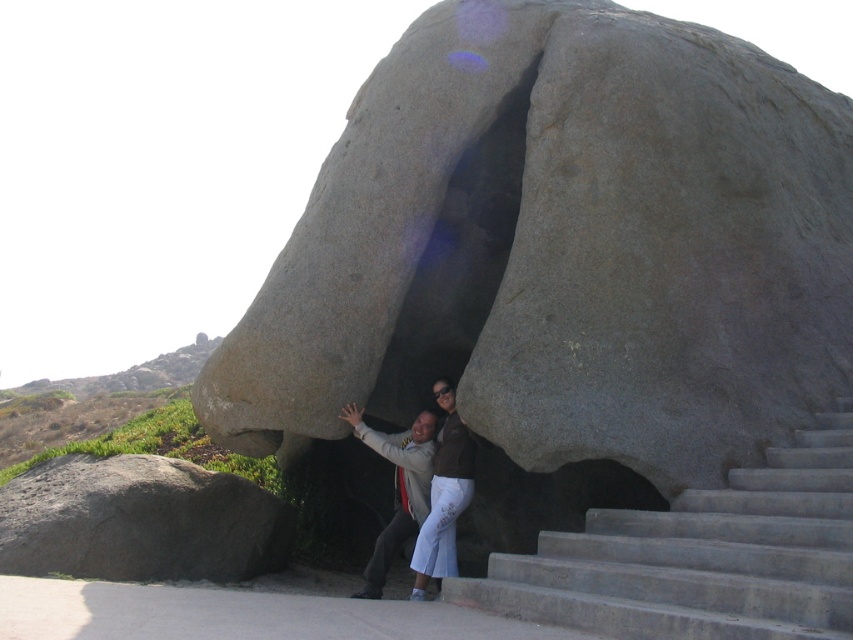
Which is more to the left, gray rough boulder at lower left or matte gray stone couple at center?

Positioned to the left is gray rough boulder at lower left.

Does gray rough boulder at lower left appear on the left side of matte gray stone couple at center?

Yes, gray rough boulder at lower left is to the left of matte gray stone couple at center.

Who is more distant from viewer, (49,528) or (467,502)?

Positioned behind is point (467,502).

I want to click on gray rough boulder at lower left, so click(140, 522).

Is concrete stairs at lower right bigger than gray rough boulder at lower left?

Yes.

Does concrete stairs at lower right have a lesser height compared to gray rough boulder at lower left?

No.

What do you see at coordinates (700, 556) in the screenshot? I see `concrete stairs at lower right` at bounding box center [700, 556].

The height and width of the screenshot is (640, 853). I want to click on concrete stairs at lower right, so click(x=700, y=556).

Can you confirm if concrete stairs at lower right is thinner than matte gray stone couple at center?

Answer: In fact, concrete stairs at lower right might be wider than matte gray stone couple at center.

Can you confirm if concrete stairs at lower right is taller than matte gray stone couple at center?

In fact, concrete stairs at lower right may be shorter than matte gray stone couple at center.

Who is more forward, (790, 589) or (456, 413)?

Point (790, 589)

You are a GUI agent. You are given a task and a screenshot of the screen. Output one action in this format:
    pyautogui.click(x=<x>, y=<y>)
    Task: Click on the concrete stairs at lower right
    The image size is (853, 640).
    Given the screenshot: What is the action you would take?
    700,556